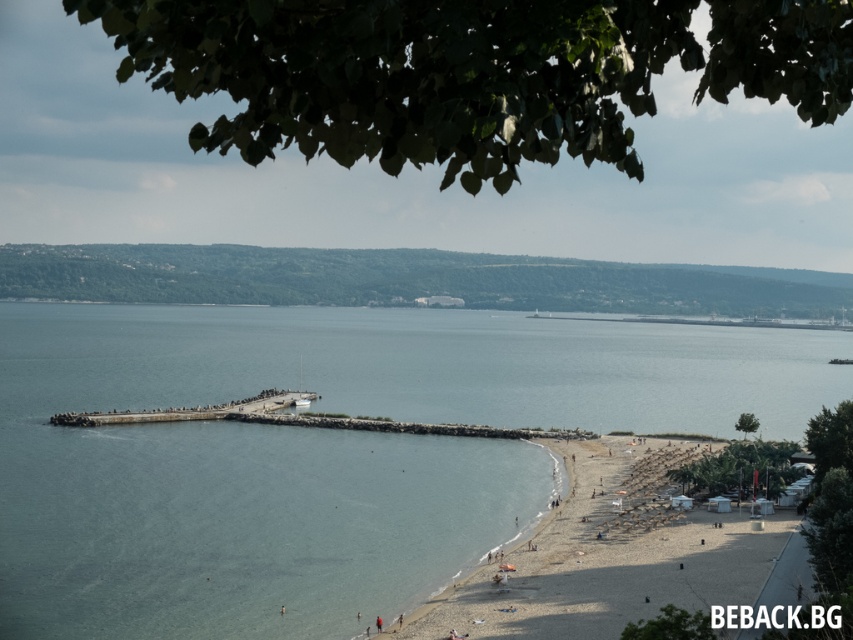
Based on the photo, you are standing on the beach and want to walk to the clear blue water at center. Which direction should you head from the light brown sand at lower right?

You should head to the left from the light brown sand at lower right to reach the clear blue water at center since the clear blue water at center is located to the left of the light brown sand at lower right.